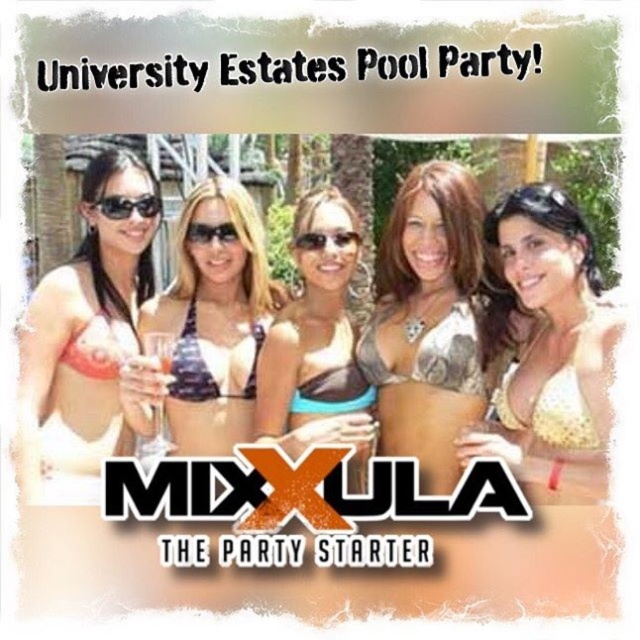
Does point (86, 429) lie behind point (188, 420)?

No, it is in front of (188, 420).

Where is `matte white bikini top at left`? matte white bikini top at left is located at coordinates (84, 333).

Does camouflage bikini top at center have a smaller size compared to white bikini top at center?

Actually, camouflage bikini top at center might be larger than white bikini top at center.

Where is `camouflage bikini top at center`? The image size is (640, 640). camouflage bikini top at center is located at coordinates (428, 323).

Is matte white bikini top at left to the right of black plastic sunglasses at left from the viewer's perspective?

Incorrect, matte white bikini top at left is not on the right side of black plastic sunglasses at left.

Is point (112, 364) positioned after point (122, 204)?

Yes, point (112, 364) is behind point (122, 204).

Is point (36, 298) positioned in front of point (125, 209)?

No, it is not.

Find the location of a particular element. The image size is (640, 640). matte white bikini top at left is located at coordinates (84, 333).